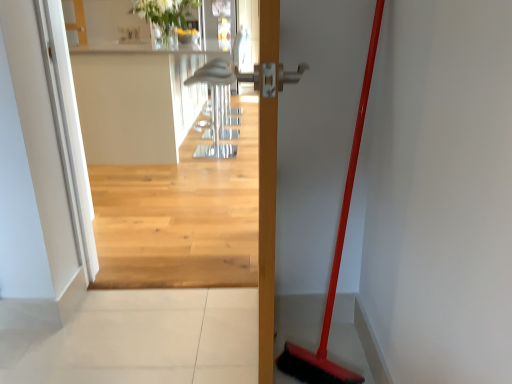
Describe the element at coordinates (164, 14) in the screenshot. Image resolution: width=512 pixels, height=384 pixels. I see `white glossy vase at upper center` at that location.

Locate an element on the screen. This screenshot has height=384, width=512. white glossy vase at upper center is located at coordinates (164, 14).

Measure the distance between point (180,23) and camera.

They are 3.48 meters apart.

What is the approximate width of red plastic broom at right?

red plastic broom at right is 4.90 inches wide.

In order to face red plastic broom at right, should I rotate leftwards or rightwards?

To align with it, rotate right about 10.568°.

Image resolution: width=512 pixels, height=384 pixels. In order to click on red plastic broom at right in this screenshot , I will do `click(335, 256)`.

Describe the element at coordinates (335, 256) in the screenshot. I see `red plastic broom at right` at that location.

I want to click on white glossy vase at upper center, so click(164, 14).

Which is more to the left, red plastic broom at right or white glossy vase at upper center?

white glossy vase at upper center is more to the left.

Does red plastic broom at right come behind white glossy vase at upper center?

No, it is in front of white glossy vase at upper center.

Which is in front, point (312, 381) or point (143, 14)?

The point (312, 381) is more forward.

From the image's perspective, is red plastic broom at right located above or below white glossy vase at upper center?

red plastic broom at right is below white glossy vase at upper center.

From a real-world perspective, which object rests below the other?

red plastic broom at right.

Does red plastic broom at right have a greater width compared to white glossy vase at upper center?

Incorrect, the width of red plastic broom at right does not surpass that of white glossy vase at upper center.

Does red plastic broom at right have a lesser height compared to white glossy vase at upper center?

In fact, red plastic broom at right may be taller than white glossy vase at upper center.

Considering the sizes of objects red plastic broom at right and white glossy vase at upper center in the image provided, who is smaller, red plastic broom at right or white glossy vase at upper center?

With smaller size is red plastic broom at right.

Is red plastic broom at right not within white glossy vase at upper center?

That's correct, red plastic broom at right is outside of white glossy vase at upper center.

Are red plastic broom at right and white glossy vase at upper center located far from each other?

Indeed, red plastic broom at right is not near white glossy vase at upper center.

Consider the image. Is white glossy vase at upper center at the back of red plastic broom at right?

No.

Where is `plant lying on the left of red plastic broom at right`? plant lying on the left of red plastic broom at right is located at coordinates (164, 14).

Between white glossy vase at upper center and red plastic broom at right, which one appears on the left side from the viewer's perspective?

white glossy vase at upper center.

Is white glossy vase at upper center in front of red plastic broom at right?

No, the depth of white glossy vase at upper center is greater than that of red plastic broom at right.

Is point (176, 15) positioned after point (287, 367)?

Yes.

From the image's perspective, which object appears higher, white glossy vase at upper center or red plastic broom at right?

white glossy vase at upper center is shown above in the image.

From a real-world perspective, which is physically below, white glossy vase at upper center or red plastic broom at right?

In real-world perspective, red plastic broom at right is lower.

Looking at their sizes, would you say white glossy vase at upper center is wider or thinner than red plastic broom at right?

Considering their sizes, white glossy vase at upper center looks broader than red plastic broom at right.

Between white glossy vase at upper center and red plastic broom at right, which one has more height?

red plastic broom at right.

In terms of size, does white glossy vase at upper center appear bigger or smaller than red plastic broom at right?

Considering their sizes, white glossy vase at upper center takes up more space than red plastic broom at right.

Looking at this image, is white glossy vase at upper center completely or partially outside of red plastic broom at right?

Yes, white glossy vase at upper center is not within red plastic broom at right.

Is white glossy vase at upper center beside red plastic broom at right?

white glossy vase at upper center and red plastic broom at right are clearly separated.

Is red plastic broom at right at the back of white glossy vase at upper center?

No.

Can you tell me how much white glossy vase at upper center and red plastic broom at right differ in facing direction?

The angle between the facing direction of white glossy vase at upper center and the facing direction of red plastic broom at right is 127 degrees.

At what (x,y) coordinates should I click in order to perform the action: click on door lying in front of the white glossy vase at upper center. Please return your answer as a coordinate pair (x, y). Looking at the image, I should click on (335, 256).

Image resolution: width=512 pixels, height=384 pixels. Find the location of `door that is below the white glossy vase at upper center (from the image's perspective)`. door that is below the white glossy vase at upper center (from the image's perspective) is located at coordinates (335, 256).

The height and width of the screenshot is (384, 512). Identify the location of plant above the red plastic broom at right (from the image's perspective). (164, 14).